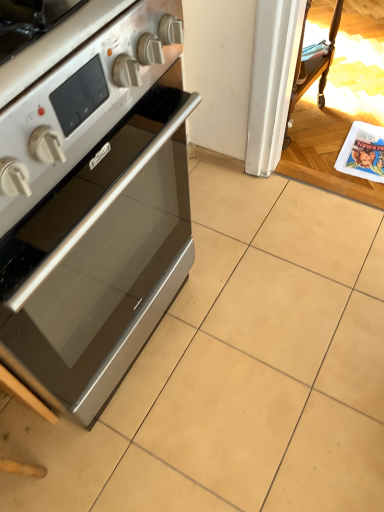
Question: Considering the positions of white glossy magazine at right and satin silver oven at left in the image, is white glossy magazine at right wider or thinner than satin silver oven at left?

Choices:
 (A) thin
 (B) wide

Answer: (A)

Question: In the image, is white glossy magazine at right positioned in front of or behind satin silver oven at left?

Choices:
 (A) front
 (B) behind

Answer: (B)

Question: In terms of size, does white glossy magazine at right appear bigger or smaller than satin silver oven at left?

Choices:
 (A) big
 (B) small

Answer: (B)

Question: Based on their sizes in the image, would you say satin silver oven at left is bigger or smaller than white glossy magazine at right?

Choices:
 (A) small
 (B) big

Answer: (B)

Question: Relative to white glossy magazine at right, is satin silver oven at left in front or behind?

Choices:
 (A) behind
 (B) front

Answer: (B)

Question: From a real-world perspective, is satin silver oven at left physically located above or below white glossy magazine at right?

Choices:
 (A) above
 (B) below

Answer: (A)

Question: Based on their positions, is satin silver oven at left located to the left or right of white glossy magazine at right?

Choices:
 (A) left
 (B) right

Answer: (A)